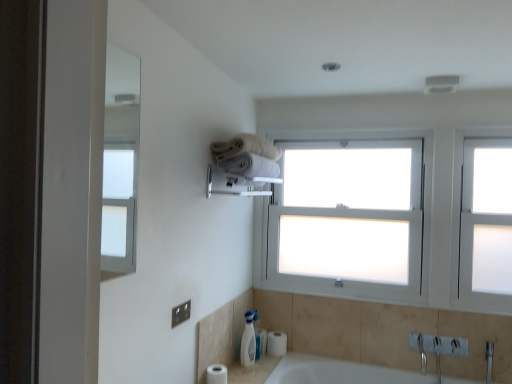
Question: From the image's perspective, is white glossy soap dispenser at lower center located above or below white ceramic sink at lower center?

Choices:
 (A) above
 (B) below

Answer: (A)

Question: Is point (247, 362) positioned closer to the camera than point (276, 362)?

Choices:
 (A) closer
 (B) farther

Answer: (A)

Question: Which object is positioned closest to the white ceramic sink at lower center?

Choices:
 (A) white matte toilet paper at lower left, the 1th toilet paper viewed from the front
 (B) white glossy soap dispenser at lower center
 (C) satin silver towel bar at upper center
 (D) frosted glass window at right
 (E) white ceramic sink at lower right

Answer: (B)

Question: Estimate the real-world distances between objects in this image. Which object is farther from the white frosted glass window at center?

Choices:
 (A) white ceramic sink at lower right
 (B) satin silver towel bar at upper center
 (C) white glossy soap dispenser at lower center
 (D) frosted glass window at right
 (E) white matte toilet paper at lower left, which appears as the 2th toilet paper when viewed from the right

Answer: (E)